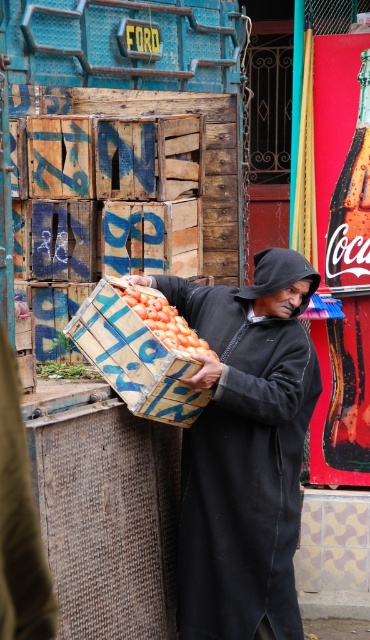
Can you confirm if black matte robe at center is positioned below smooth orange tomatoes at center?

Yes, black matte robe at center is below smooth orange tomatoes at center.

Which is more to the right, black matte robe at center or smooth orange tomatoes at center?

Positioned to the right is black matte robe at center.

Is point (207, 620) positioned in front of point (136, 305)?

That is False.

This screenshot has width=370, height=640. I want to click on black matte robe at center, so click(246, 452).